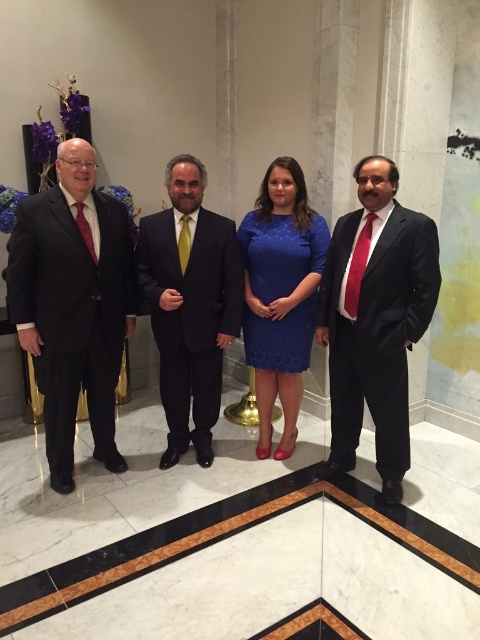
Question: Among these objects, which one is farthest from the camera?

Choices:
 (A) matte black suit at left
 (B) blue textured dress at center
 (C) shiny black suit at right
 (D) shiny dark suit at center

Answer: (B)

Question: Is shiny black suit at right positioned before blue textured dress at center?

Choices:
 (A) no
 (B) yes

Answer: (B)

Question: Which object is farther from the camera taking this photo?

Choices:
 (A) matte black suit at left
 (B) shiny dark suit at center

Answer: (B)

Question: Does shiny black suit at right lie behind shiny dark suit at center?

Choices:
 (A) no
 (B) yes

Answer: (A)

Question: Among these objects, which one is farthest from the camera?

Choices:
 (A) matte black suit at left
 (B) shiny dark suit at center
 (C) blue textured dress at center

Answer: (C)

Question: Does matte black suit at left have a smaller size compared to shiny dark suit at center?

Choices:
 (A) no
 (B) yes

Answer: (A)